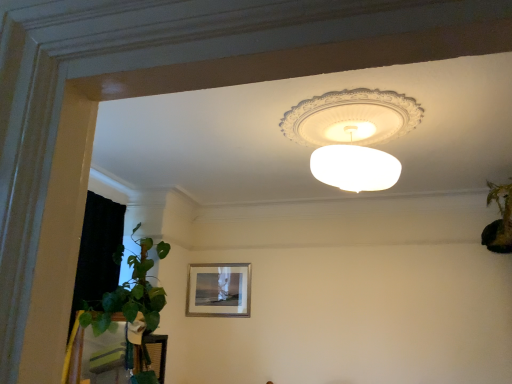
Question: Is matte silver picture frame at center at the left side of green leafy plant at right?

Choices:
 (A) no
 (B) yes

Answer: (B)

Question: Considering the relative positions of matte silver picture frame at center and green leafy plant at right in the image provided, is matte silver picture frame at center in front of green leafy plant at right?

Choices:
 (A) no
 (B) yes

Answer: (A)

Question: Is matte silver picture frame at center outside green leafy plant at right?

Choices:
 (A) yes
 (B) no

Answer: (A)

Question: From the image's perspective, does matte silver picture frame at center appear higher than green leafy plant at right?

Choices:
 (A) yes
 (B) no

Answer: (B)

Question: Can you confirm if matte silver picture frame at center is taller than green leafy plant at right?

Choices:
 (A) yes
 (B) no

Answer: (A)

Question: Considering the relative sizes of matte silver picture frame at center and green leafy plant at right in the image provided, is matte silver picture frame at center bigger than green leafy plant at right?

Choices:
 (A) no
 (B) yes

Answer: (A)

Question: From a real-world perspective, does white frosted glass lampshade at upper center sit lower than matte silver picture frame at center?

Choices:
 (A) yes
 (B) no

Answer: (B)

Question: Does white frosted glass lampshade at upper center have a lesser height compared to matte silver picture frame at center?

Choices:
 (A) yes
 (B) no

Answer: (A)

Question: Is white frosted glass lampshade at upper center looking in the opposite direction of matte silver picture frame at center?

Choices:
 (A) yes
 (B) no

Answer: (B)

Question: From a real-world perspective, is white frosted glass lampshade at upper center physically above matte silver picture frame at center?

Choices:
 (A) no
 (B) yes

Answer: (B)

Question: From the image's perspective, does white frosted glass lampshade at upper center appear higher than matte silver picture frame at center?

Choices:
 (A) no
 (B) yes

Answer: (B)

Question: Can you confirm if white frosted glass lampshade at upper center is smaller than matte silver picture frame at center?

Choices:
 (A) no
 (B) yes

Answer: (A)

Question: Can you confirm if green leafy plant at right is smaller than matte silver picture frame at center?

Choices:
 (A) no
 (B) yes

Answer: (A)